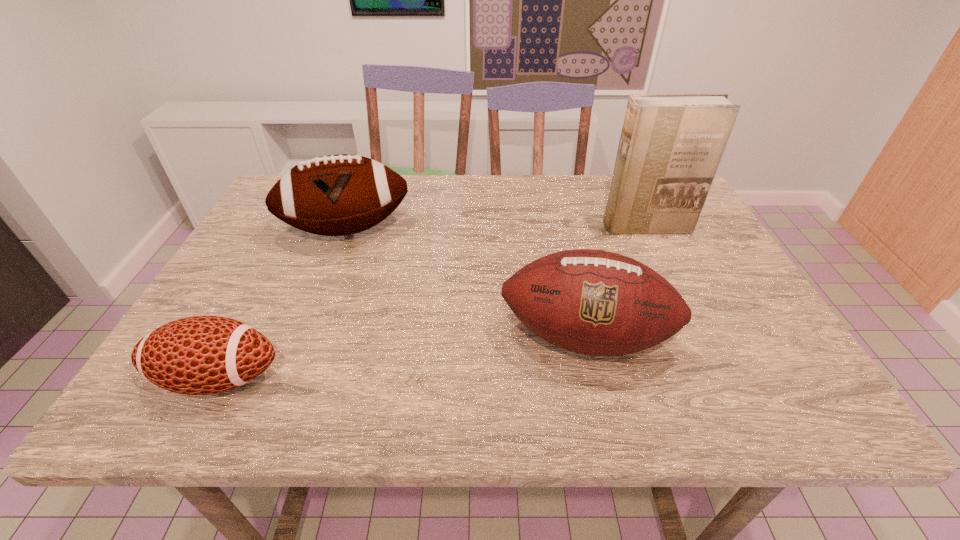
At what (x,y) coordinates should I click in order to perform the action: click on football that stands as the closest to the farthest football. Please return your answer as a coordinate pair (x, y). Image resolution: width=960 pixels, height=540 pixels. Looking at the image, I should click on (593, 302).

Where is `free space that satisfies the following two spatial constraints: 1. on the back side of the shortest object; 2. on the left side of the farthest football`? The image size is (960, 540). free space that satisfies the following two spatial constraints: 1. on the back side of the shortest object; 2. on the left side of the farthest football is located at coordinates (297, 230).

Where is `vacant space that satisfies the following two spatial constraints: 1. on the front side of the rightmost football; 2. on the right side of the farthest football`? vacant space that satisfies the following two spatial constraints: 1. on the front side of the rightmost football; 2. on the right side of the farthest football is located at coordinates tap(306, 337).

At what (x,y) coordinates should I click in order to perform the action: click on free region that satisfies the following two spatial constraints: 1. on the front side of the rightmost football; 2. on the right side of the farthest football. Please return your answer as a coordinate pair (x, y). Image resolution: width=960 pixels, height=540 pixels. Looking at the image, I should click on (306, 337).